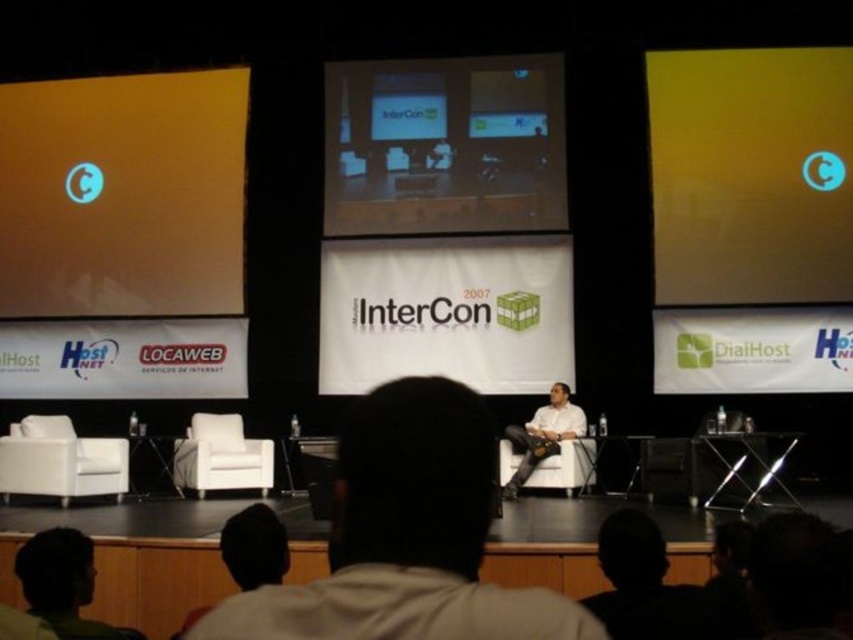
Question: Which of these objects is positioned farthest from the white fabric chair at center?

Choices:
 (A) orange matte projection screen at left
 (B) matte black monitor at center
 (C) green fabric head at lower left

Answer: (A)

Question: Among these objects, which one is nearest to the camera?

Choices:
 (A) white fabric chair at center
 (B) yellow matte screen at upper right

Answer: (A)

Question: Which point is farther from the camera taking this photo?

Choices:
 (A) (457, 163)
 (B) (105, 204)

Answer: (B)

Question: Can you confirm if orange matte projection screen at left is positioned below green fabric head at lower left?

Choices:
 (A) no
 (B) yes

Answer: (A)

Question: Is the position of yellow matte screen at upper right less distant than that of light brown leather jacket at center?

Choices:
 (A) no
 (B) yes

Answer: (A)

Question: Is yellow matte screen at upper right to the left of light brown leather jacket at center from the viewer's perspective?

Choices:
 (A) yes
 (B) no

Answer: (B)